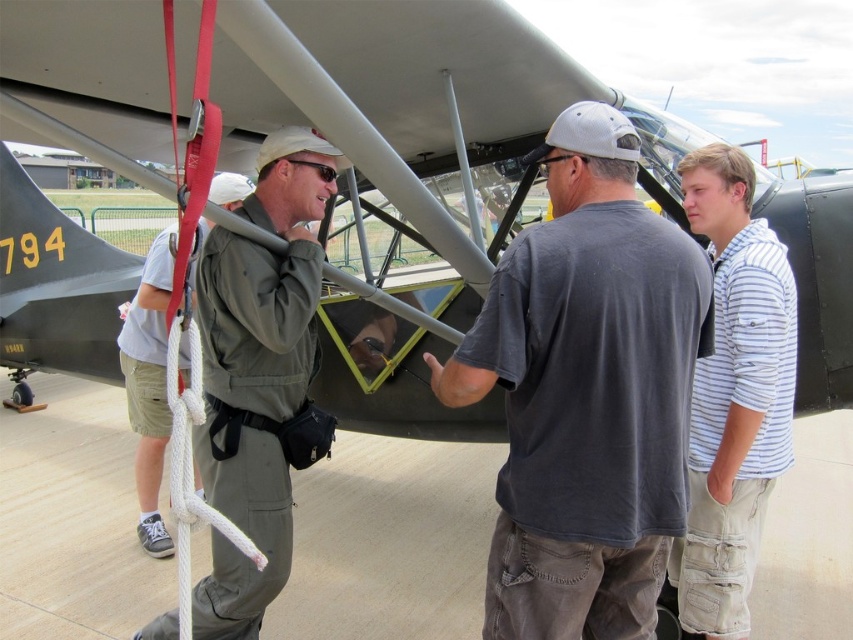
You are standing in front of the vintage biplane at the airshow. There are two points marked on the plane. One is at coordinate point (473, 401) and the other is at point (250, 285). Which of these two points is closer to you?

Point (473, 401) is closer to the viewer than point (250, 285).

You are a photographer at the airshow trying to capture a photo of the vintage biplane. You notice two people in the foreground wearing the green fabric pilot jacket at center and the white striped shirt at right. Since you want to ensure both are visible in the frame, which person should you position closer to the front to avoid them being obscured?

The green fabric pilot jacket at center is much taller than the white striped shirt at right, so to avoid obscuring them, position the white striped shirt at right closer to the front of the frame.